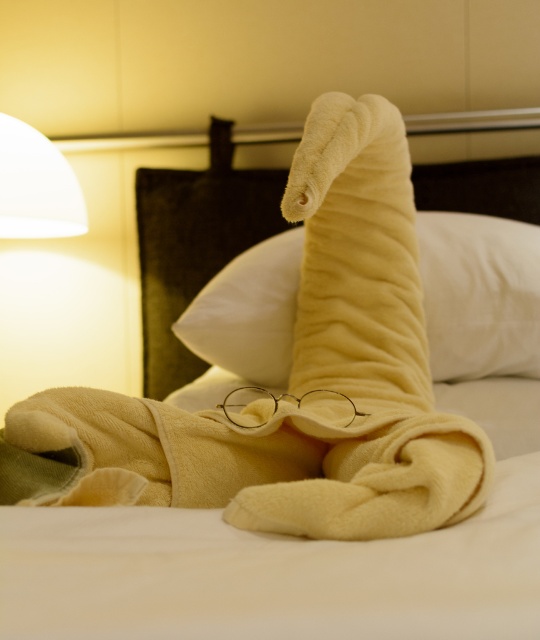
You are arranging a cozy reading nook in the bedroom. You have a yellow plush pillow at center and a white matte lampshade at upper left. Which object is taller when viewed from the bed?

The yellow plush pillow at center is taller than the white matte lampshade at upper left.

From the picture: You are standing in the bedroom scene. There are two points marked in the image. The first point is at coordinates point (442, 259), and the second point is at coordinates point (40, 132). From your perspective, which point is closer to you?

Point (442, 259) is in front of point (40, 132), so it is closer to you.

You are lying in bed and want to reach both the yellow plush pillow at center and the white matte lampshade at upper left. Which object is easier to grab without moving your head?

The yellow plush pillow at center is closer to the viewer than the white matte lampshade at upper left, so it is easier to grab without moving your head.